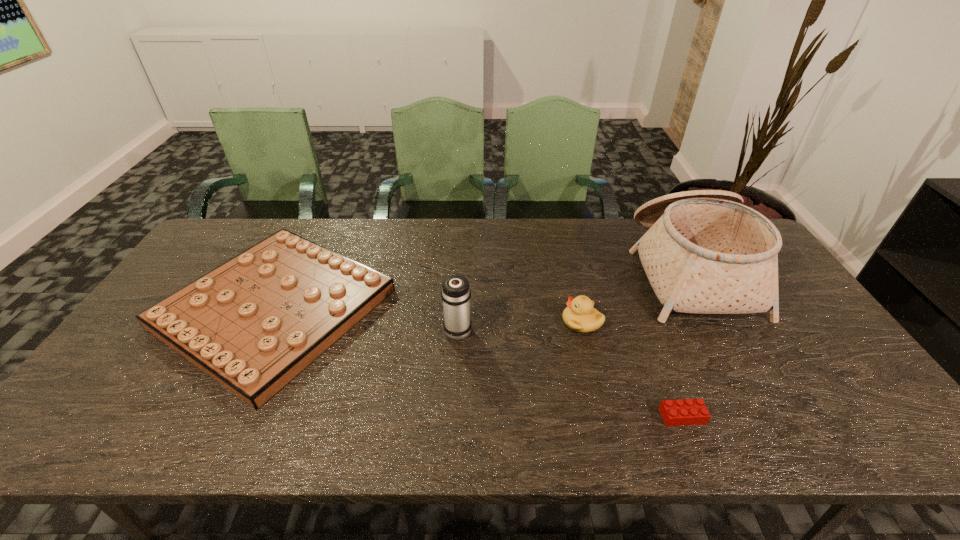
At what (x,y) coordinates should I click in order to perform the action: click on gameboard present at the far edge. Please return your answer as a coordinate pair (x, y). Looking at the image, I should click on (253, 323).

At what (x,y) coordinates should I click in order to perform the action: click on object that is at the near edge. Please return your answer as a coordinate pair (x, y). Looking at the image, I should click on (681, 412).

The height and width of the screenshot is (540, 960). Find the location of `object situated at the left edge`. object situated at the left edge is located at coordinates (253, 323).

In order to click on object located at the right edge in this screenshot , I will do `click(705, 252)`.

The width and height of the screenshot is (960, 540). In order to click on object located in the far left corner section of the desktop in this screenshot , I will do `click(253, 323)`.

Image resolution: width=960 pixels, height=540 pixels. I want to click on object situated at the far right corner, so click(x=705, y=252).

Where is `vacant space at the far edge of the desktop`? vacant space at the far edge of the desktop is located at coordinates (451, 221).

In the image, there is a desktop. Where is `vacant space at the right edge`? vacant space at the right edge is located at coordinates (783, 323).

At what (x,y) coordinates should I click in order to perform the action: click on vacant space at the near left corner of the desktop. Please return your answer as a coordinate pair (x, y). The image size is (960, 540). Looking at the image, I should click on (117, 420).

The width and height of the screenshot is (960, 540). In order to click on blank space at the near right corner of the desktop in this screenshot , I will do `click(869, 424)`.